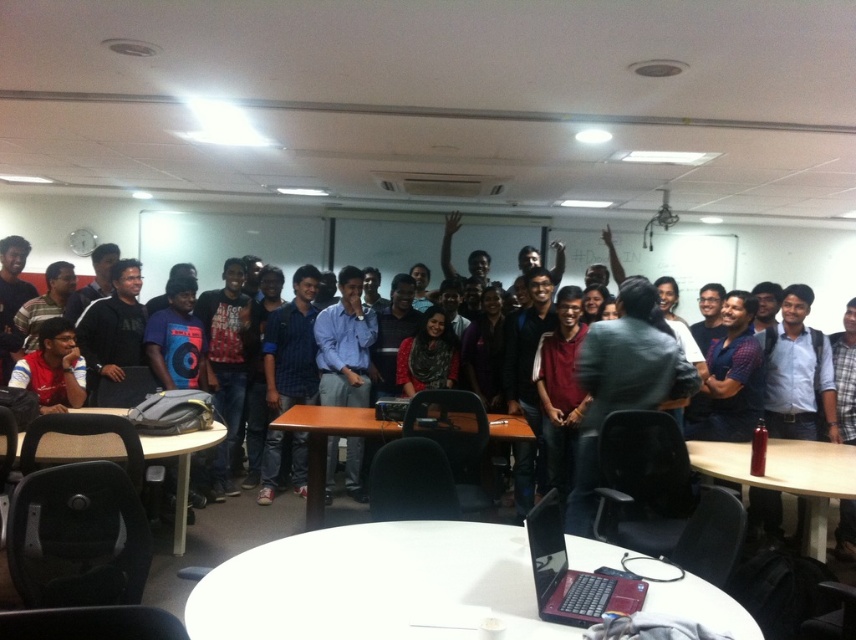
You are organizing a small presentation in the classroom and need to place both the metallic silver table at lower right and the red matte laptop at lower center on the stage. Which object has a larger width and should be placed first to ensure proper spacing?

The metallic silver table at lower right has a larger width than the red matte laptop at lower center, so it should be placed first to ensure proper spacing.

Please describe the position of the red matte laptop at lower center in terms of coordinates within the image. Use the coordinate system where the bottom left corner is the origin point.

The red matte laptop at lower center is located at coordinates approximately 0.898 on the x axis and 0.669 on the y axis, with the bottom left corner of the image as the origin point.

You are standing at the point marked as point [852,449] in the image. You need to reach the door located at the opposite side of the room. The door is 2.5 meters away from your current position. Can you walk straight to the door without any obstacles?

The distance between you and the viewer is 3.92 meters, but the door is only 2.5 meters away. Since the door is closer than the viewer, you can walk straight to the door without any obstacles as there is enough space.